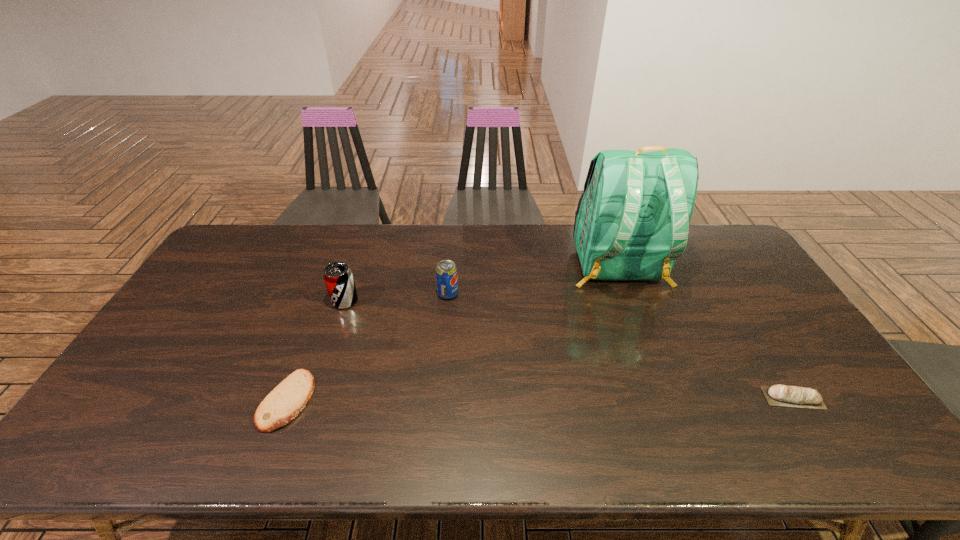
Locate an element on the screen. This screenshot has width=960, height=540. vacant space located on the left of the left pita bread is located at coordinates (144, 400).

The width and height of the screenshot is (960, 540). What are the coordinates of `object positioned at the far edge` in the screenshot? It's located at (632, 222).

Locate an element on the screen. The image size is (960, 540). object that is at the near edge is located at coordinates (286, 401).

Where is `object situated at the right edge`? Image resolution: width=960 pixels, height=540 pixels. object situated at the right edge is located at coordinates (807, 398).

You are a GUI agent. You are given a task and a screenshot of the screen. Output one action in this format:
    pyautogui.click(x=<x>, y=<y>)
    Task: Click on the free space at the far edge
    
    Given the screenshot: What is the action you would take?
    pyautogui.click(x=514, y=244)

The width and height of the screenshot is (960, 540). Find the location of `vacant space at the near edge of the desktop`. vacant space at the near edge of the desktop is located at coordinates (772, 444).

This screenshot has width=960, height=540. In order to click on vacant space at the left edge of the desktop in this screenshot , I will do `click(182, 383)`.

Image resolution: width=960 pixels, height=540 pixels. Find the location of `free spot at the right edge of the desktop`. free spot at the right edge of the desktop is located at coordinates (731, 289).

The width and height of the screenshot is (960, 540). In order to click on free region at the far left corner of the desktop in this screenshot , I will do `click(249, 248)`.

You are a GUI agent. You are given a task and a screenshot of the screen. Output one action in this format:
    pyautogui.click(x=<x>, y=<y>)
    Task: Click on the blank area at the far right corner
    
    Given the screenshot: What is the action you would take?
    pyautogui.click(x=726, y=240)